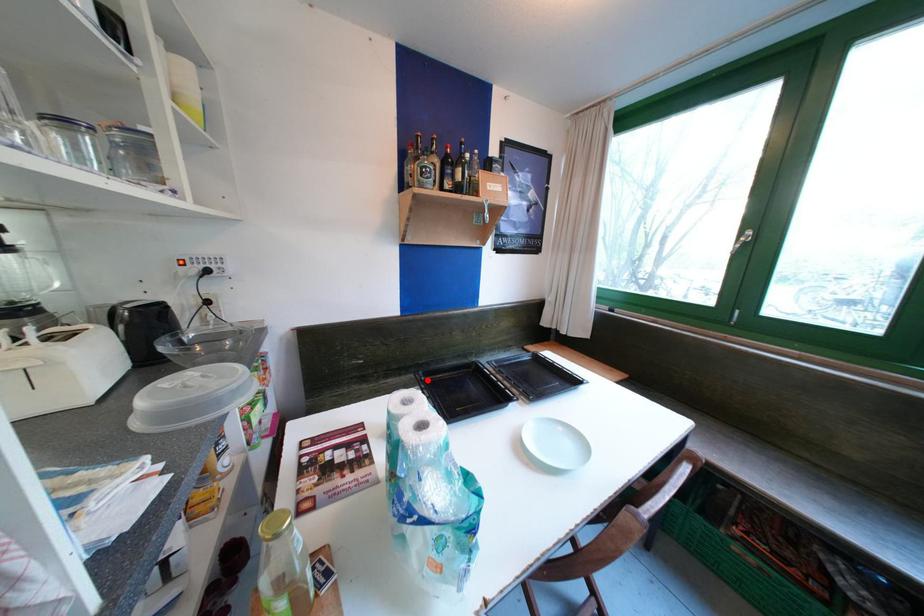
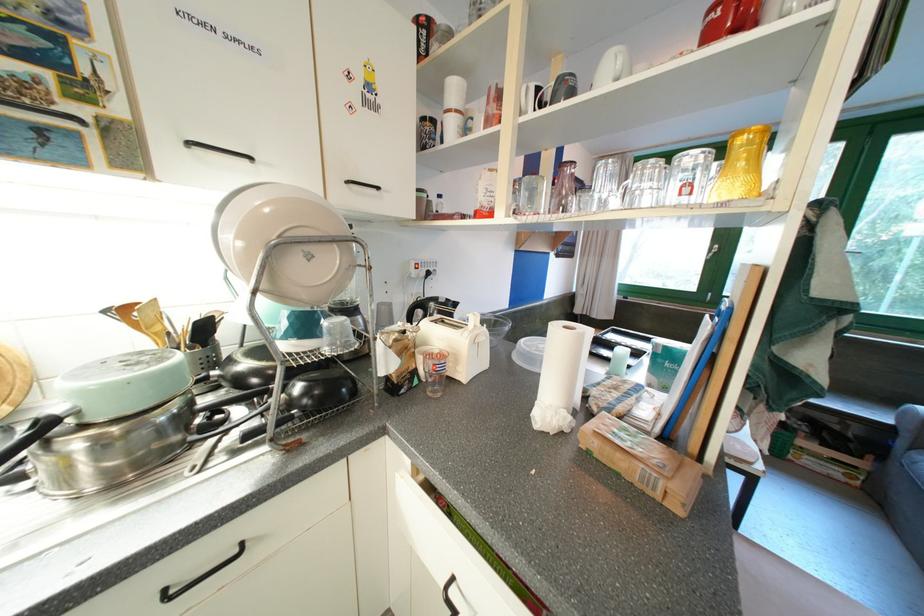
Question: I am providing you with two images of the same scene from different viewpoints. A red point is marked on the first image. Can you still see the location of the red point in image 2?

Choices:
 (A) Yes
 (B) No

Answer: (B)